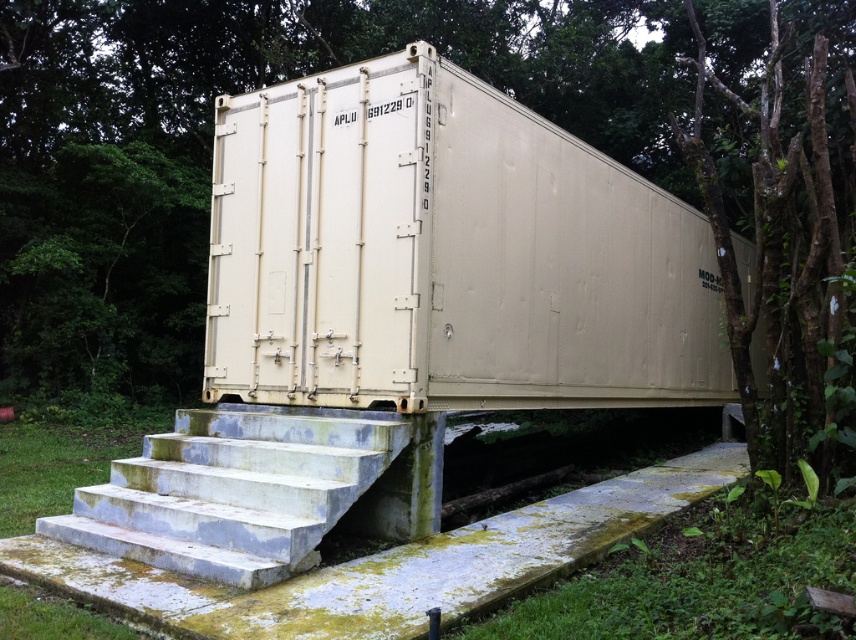
Question: Does smooth concrete stairs at lower center appear on the right side of green leafy tree at upper right?

Choices:
 (A) yes
 (B) no

Answer: (B)

Question: Which object is positioned closest to the green leafy tree at upper right?

Choices:
 (A) smooth concrete stairs at lower center
 (B) beige matte container at center

Answer: (B)

Question: Is smooth concrete stairs at lower center to the right of green leafy tree at upper right from the viewer's perspective?

Choices:
 (A) yes
 (B) no

Answer: (B)

Question: Considering the real-world distances, which object is farthest from the green leafy tree at upper right?

Choices:
 (A) beige matte container at center
 (B) smooth concrete stairs at lower center

Answer: (B)

Question: Is beige matte container at center wider than green leafy tree at upper right?

Choices:
 (A) yes
 (B) no

Answer: (B)

Question: Among these points, which one is nearest to the camera?

Choices:
 (A) (823, 241)
 (B) (257, 317)
 (C) (317, 476)

Answer: (C)